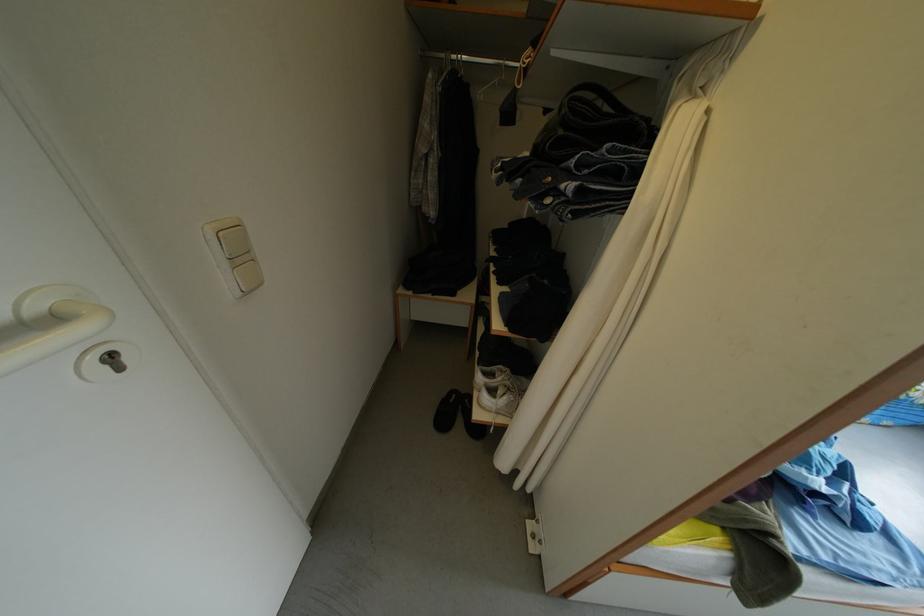
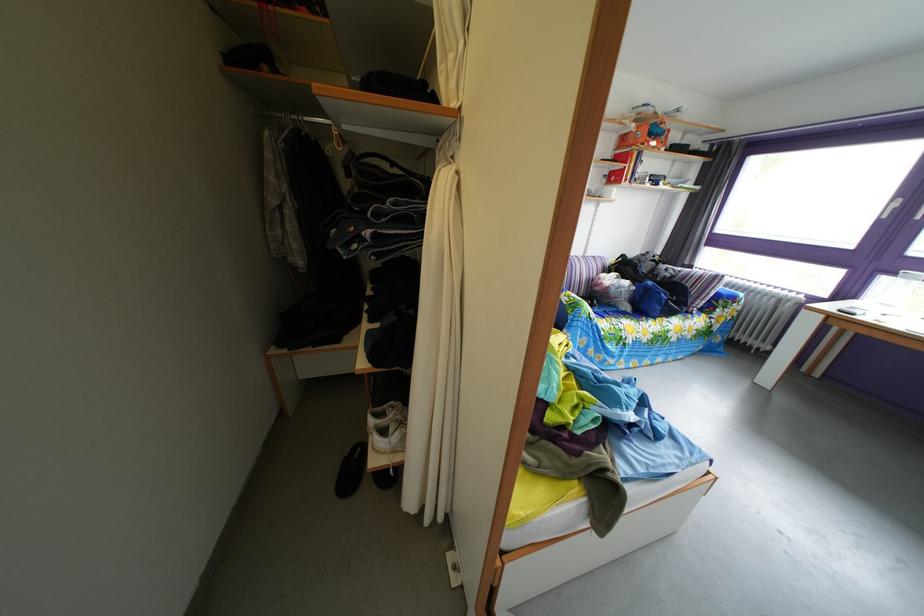
In the second image, find the point that corresponds to pixel 662 156 in the first image.

(438, 207)